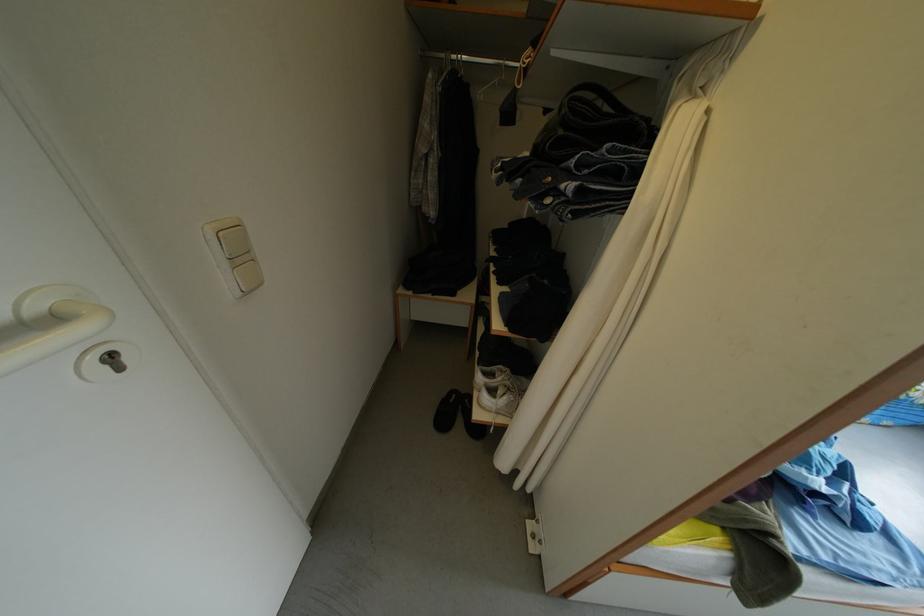
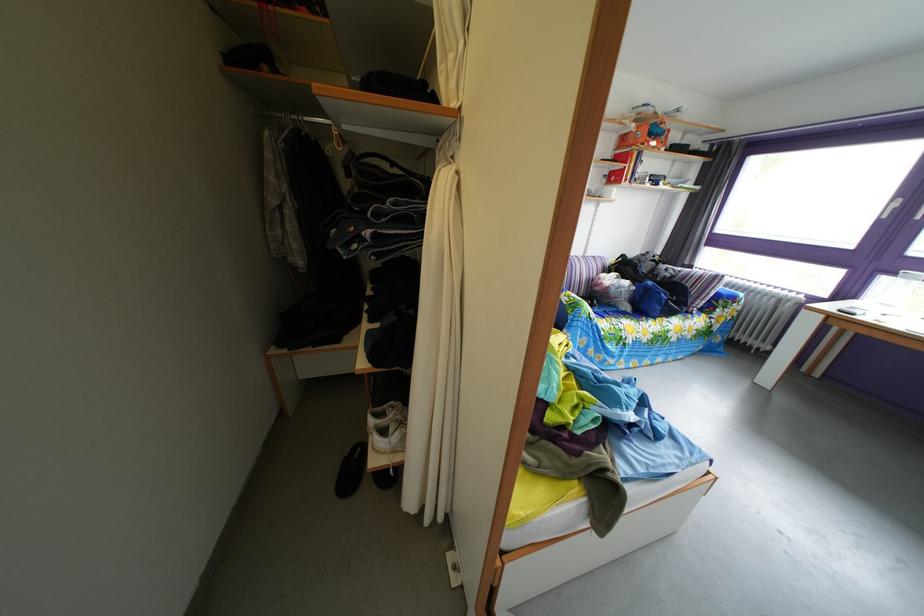
In the second image, find the point that corresponds to pixel 662 156 in the first image.

(438, 207)